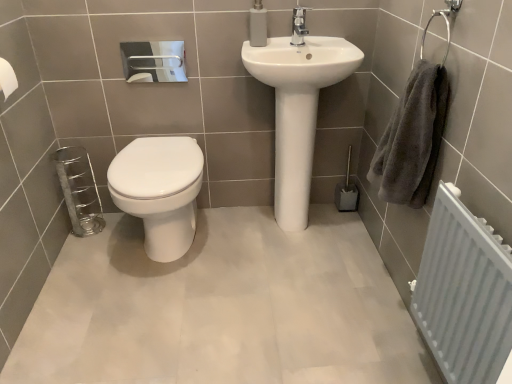
Image resolution: width=512 pixels, height=384 pixels. Identify the location of vacant space positioned to the left of white glossy toilet at center. (82, 259).